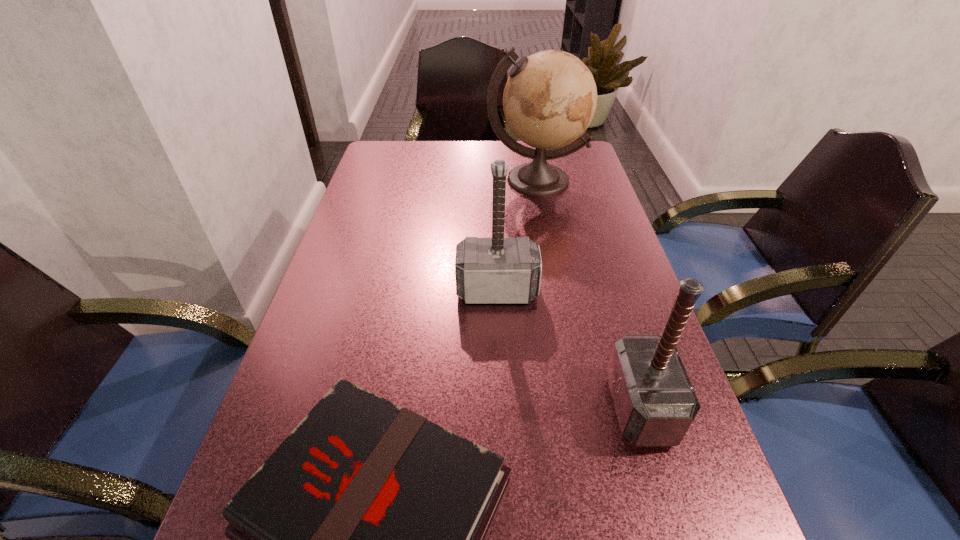
Identify the location of hammer that is positioned at the right edge. The width and height of the screenshot is (960, 540). (655, 403).

Where is `object located in the far right corner section of the desktop`? The image size is (960, 540). object located in the far right corner section of the desktop is located at coordinates pyautogui.click(x=550, y=98).

You are a GUI agent. You are given a task and a screenshot of the screen. Output one action in this format:
    pyautogui.click(x=<x>, y=<y>)
    Task: Click on the vacant space at the far edge
    The width and height of the screenshot is (960, 540).
    Given the screenshot: What is the action you would take?
    (469, 157)

This screenshot has height=540, width=960. In the image, there is a desktop. Identify the location of vacant space at the left edge. (390, 179).

Identify the location of vacant space at the right edge of the desktop. Image resolution: width=960 pixels, height=540 pixels. (603, 355).

In the image, there is a desktop. Identify the location of vacant space at the far left corner. The height and width of the screenshot is (540, 960). (404, 147).

Find the location of a particular element. This screenshot has height=540, width=960. vacant space that is in between the third nearest object and the nearer hammer is located at coordinates (568, 349).

Identify the location of vacant space that is in between the nearer hammer and the farther hammer. tap(568, 349).

You are a GUI agent. You are given a task and a screenshot of the screen. Output one action in this format:
    pyautogui.click(x=<x>, y=<y>)
    Task: Click on the vacant area that lies between the right hammer and the globe
    The width and height of the screenshot is (960, 540).
    Given the screenshot: What is the action you would take?
    pyautogui.click(x=588, y=293)

Identify the location of free spot between the left hammer and the farthest object. The width and height of the screenshot is (960, 540). (516, 235).